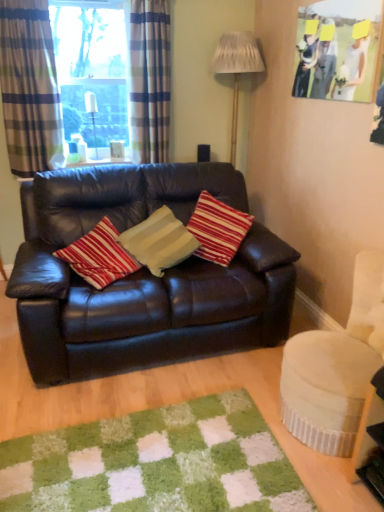
The width and height of the screenshot is (384, 512). Identify the location of vacant region to the left of velvet cream swivel chair at lower right. (241, 391).